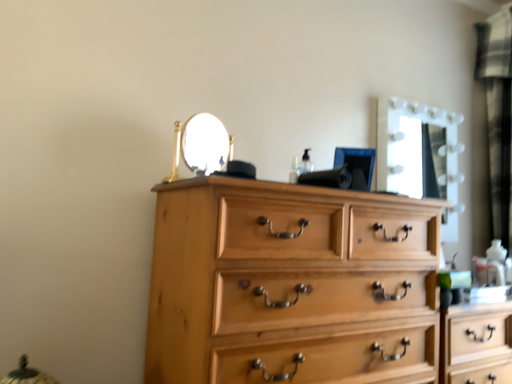
Question: Is natural wood chest of drawers at center far from black textured curtain at right?

Choices:
 (A) yes
 (B) no

Answer: (A)

Question: Is natural wood chest of drawers at center not within black textured curtain at right?

Choices:
 (A) yes
 (B) no

Answer: (A)

Question: Does natural wood chest of drawers at center have a greater width compared to black textured curtain at right?

Choices:
 (A) yes
 (B) no

Answer: (A)

Question: From the image's perspective, is natural wood chest of drawers at center above black textured curtain at right?

Choices:
 (A) no
 (B) yes

Answer: (A)

Question: From the image's perspective, is natural wood chest of drawers at center under black textured curtain at right?

Choices:
 (A) yes
 (B) no

Answer: (A)

Question: Considering the positions of black textured curtain at right and white glossy mirror at upper right in the image, is black textured curtain at right bigger or smaller than white glossy mirror at upper right?

Choices:
 (A) small
 (B) big

Answer: (A)

Question: Choose the correct answer: Is black textured curtain at right inside white glossy mirror at upper right or outside it?

Choices:
 (A) inside
 (B) outside

Answer: (B)

Question: Considering the positions of black textured curtain at right and white glossy mirror at upper right in the image, is black textured curtain at right taller or shorter than white glossy mirror at upper right?

Choices:
 (A) tall
 (B) short

Answer: (A)

Question: From the image's perspective, is black textured curtain at right positioned above or below white glossy mirror at upper right?

Choices:
 (A) below
 (B) above

Answer: (B)

Question: In the image, is natural wood chest of drawers at center positioned in front of or behind white glossy mirror at upper right?

Choices:
 (A) behind
 (B) front

Answer: (B)

Question: In terms of height, does natural wood chest of drawers at center look taller or shorter compared to white glossy mirror at upper right?

Choices:
 (A) short
 (B) tall

Answer: (B)

Question: Is natural wood chest of drawers at center wider or thinner than white glossy mirror at upper right?

Choices:
 (A) thin
 (B) wide

Answer: (B)

Question: Based on their sizes in the image, would you say natural wood chest of drawers at center is bigger or smaller than white glossy mirror at upper right?

Choices:
 (A) big
 (B) small

Answer: (A)

Question: Would you say black textured curtain at right is to the left or to the right of natural wood chest of drawers at center in the picture?

Choices:
 (A) left
 (B) right

Answer: (B)

Question: Relative to natural wood chest of drawers at center, is black textured curtain at right in front or behind?

Choices:
 (A) behind
 (B) front

Answer: (A)